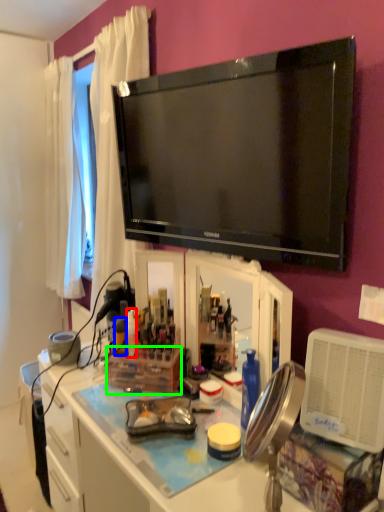
Question: Estimate the real-world distances between objects in this image. Which object is farther from bottle (highlighted by a red box), bottle (highlighted by a blue box) or box (highlighted by a green box)?

Choices:
 (A) bottle
 (B) box

Answer: (B)